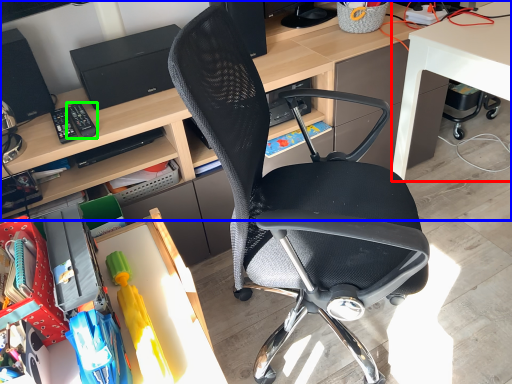
Question: Considering the real-world distances, which object is farthest from desk (highlighted by a red box)? desk (highlighted by a blue box) or remote control (highlighted by a green box)?

Choices:
 (A) desk
 (B) remote control

Answer: (B)